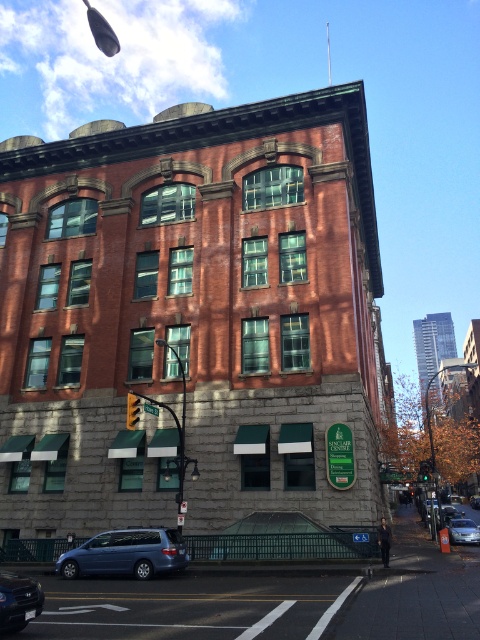
Can you confirm if metallic blue minivan at lower left is positioned to the left of matte black sedan at lower left?

Correct, you'll find metallic blue minivan at lower left to the left of matte black sedan at lower left.

Between metallic blue minivan at lower left and matte black sedan at lower left, which one is positioned higher?

matte black sedan at lower left

Image resolution: width=480 pixels, height=640 pixels. What are the coordinates of `metallic blue minivan at lower left` in the screenshot? It's located at (126, 554).

Find the location of a particular element. This screenshot has height=640, width=480. metallic blue minivan at lower left is located at coordinates (126, 554).

Between metallic blue minivan at lower left and silver metallic sedan at lower right, which one appears on the right side from the viewer's perspective?

Positioned to the right is silver metallic sedan at lower right.

Is point (147, 547) positioned in front of point (454, 538)?

Yes, point (147, 547) is closer to viewer.

You are a GUI agent. You are given a task and a screenshot of the screen. Output one action in this format:
    pyautogui.click(x=<x>, y=<y>)
    Task: Click on the metallic blue minivan at lower left
    
    Given the screenshot: What is the action you would take?
    pyautogui.click(x=126, y=554)

From the picture: Can you confirm if matte black sedan at lower left is smaller than silver metallic sedan at lower right?

Indeed, matte black sedan at lower left has a smaller size compared to silver metallic sedan at lower right.

Which is behind, point (25, 577) or point (467, 522)?

The point (467, 522) is behind.

The width and height of the screenshot is (480, 640). I want to click on matte black sedan at lower left, so click(17, 602).